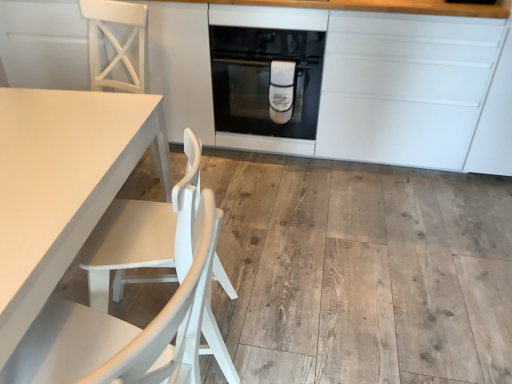
Question: Relative to white matte table at left, is white matte chair at left, the 1th chair positioned from the top, in front or behind?

Choices:
 (A) front
 (B) behind

Answer: (B)

Question: In terms of width, does white matte chair at left, the second chair in the front-to-back sequence, look wider or thinner when compared to white matte table at left?

Choices:
 (A) thin
 (B) wide

Answer: (A)

Question: Considering the real-world distances, which object is farthest from the white matte wood chair at lower left, the 2th chair in the top-to-bottom sequence?

Choices:
 (A) white matte cabinetry at center
 (B) white matte chair at left, the second chair in the front-to-back sequence
 (C) black glass oven at center
 (D) white matte table at left

Answer: (A)

Question: Which object is positioned closest to the white matte cabinetry at center?

Choices:
 (A) black glass oven at center
 (B) white matte table at left
 (C) white matte wood chair at lower left, the 2th chair in the top-to-bottom sequence
 (D) white matte chair at left, the second chair in the front-to-back sequence

Answer: (A)